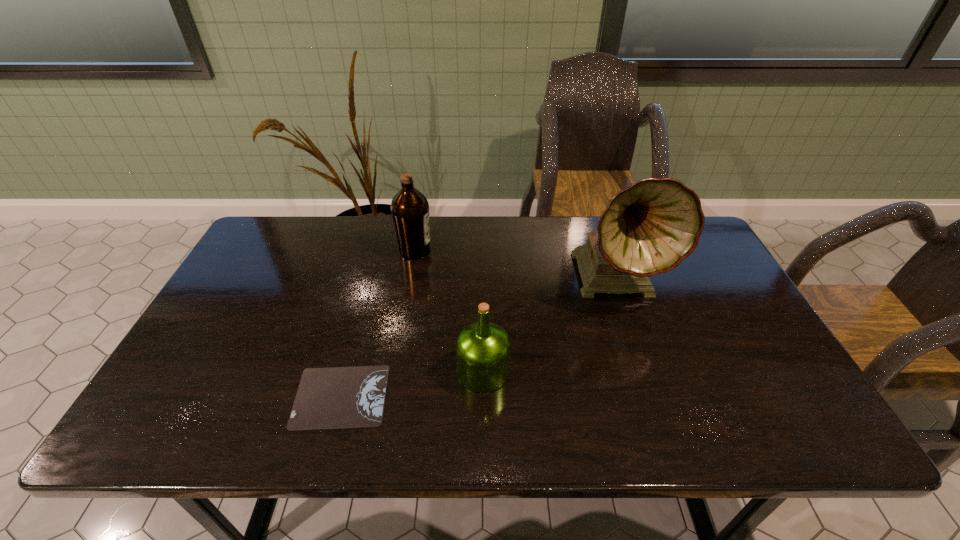
This screenshot has width=960, height=540. In order to click on record player in this screenshot , I will do `click(649, 228)`.

The height and width of the screenshot is (540, 960). I want to click on the rightmost object, so click(649, 228).

The width and height of the screenshot is (960, 540). What are the coordinates of `the third shortest object` in the screenshot? It's located at (410, 209).

Identify the location of the taller olive oil. Image resolution: width=960 pixels, height=540 pixels. (410, 209).

Locate an element on the screen. the nearer olive oil is located at coordinates (483, 349).

Locate an element on the screen. This screenshot has height=540, width=960. the third object from left to right is located at coordinates 483,349.

Locate an element on the screen. This screenshot has width=960, height=540. mousepad is located at coordinates (339, 397).

Locate an element on the screen. This screenshot has height=540, width=960. vacant space located 0.070m from the horn of the record player is located at coordinates (636, 338).

At what (x,y) coordinates should I click in order to perform the action: click on vacant space located on the label of the taller olive oil. Please return your answer as a coordinate pair (x, y). The width and height of the screenshot is (960, 540). Looking at the image, I should click on (474, 251).

Find the location of a particular element. The width and height of the screenshot is (960, 540). free space located 0.140m on the back of the nearer olive oil is located at coordinates (483, 309).